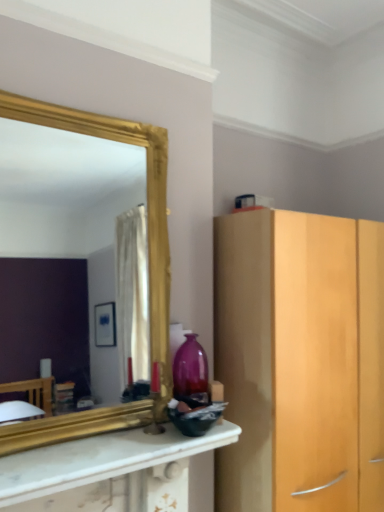
You are a GUI agent. You are given a task and a screenshot of the screen. Output one action in this format:
    pyautogui.click(x=<x>, y=<y>)
    Task: Click on the matte purple glass vase at center
    
    Given the screenshot: What is the action you would take?
    pyautogui.click(x=190, y=369)

Where is `white marble countertop at center`? This screenshot has width=384, height=512. white marble countertop at center is located at coordinates coord(108,472).

The width and height of the screenshot is (384, 512). What do you see at coordinates (69, 210) in the screenshot? I see `gold-framed mirror at upper left` at bounding box center [69, 210].

This screenshot has height=512, width=384. I want to click on matte purple glass vase at center, so click(x=190, y=369).

Does point (82, 158) appear closer or farther from the camera than point (21, 501)?

Point (82, 158) appears to be farther away from the viewer than point (21, 501).

Is gold-framed mirror at upper left spatially inside white marble countertop at center, or outside of it?

gold-framed mirror at upper left is not inside white marble countertop at center, it's outside.

You are a GUI agent. You are given a task and a screenshot of the screen. Output one action in this format:
    pyautogui.click(x=<x>, y=<y>)
    Task: Click on the mirror on the left of white marble countertop at center
    The height and width of the screenshot is (512, 384).
    Given the screenshot: What is the action you would take?
    pyautogui.click(x=69, y=210)

Between gold-framed mirror at upper left and white marble countertop at center, which one has larger width?

Wider between the two is white marble countertop at center.

From a real-world perspective, which object stands above the other?

In real-world perspective, gold-framed mirror at upper left is above.

Considering the positions of objects matte purple glass vase at center and gold-framed mirror at upper left in the image provided, who is more to the right, matte purple glass vase at center or gold-framed mirror at upper left?

From the viewer's perspective, matte purple glass vase at center appears more on the right side.

Considering the sizes of objects matte purple glass vase at center and gold-framed mirror at upper left in the image provided, who is shorter, matte purple glass vase at center or gold-framed mirror at upper left?

matte purple glass vase at center is shorter.

Is matte purple glass vase at center not close to gold-framed mirror at upper left?

Yes, matte purple glass vase at center is far from gold-framed mirror at upper left.

Could you tell me if white marble countertop at center is facing matte purple glass vase at center?

No, white marble countertop at center is not oriented towards matte purple glass vase at center.

Which of these two, white marble countertop at center or matte purple glass vase at center, stands taller?

matte purple glass vase at center is taller.

Which object is closer to the camera taking this photo, white marble countertop at center or matte purple glass vase at center?

white marble countertop at center is in front.

Is matte purple glass vase at center facing away from white marble countertop at center?

No.

Are matte purple glass vase at center and white marble countertop at center far apart?

Actually, matte purple glass vase at center and white marble countertop at center are a little close together.

Can you confirm if matte purple glass vase at center is bigger than white marble countertop at center?

No, matte purple glass vase at center is not bigger than white marble countertop at center.

How different are the orientations of gold-framed mirror at upper left and matte purple glass vase at center in degrees?

7.44 degrees.

Considering the points (101, 232) and (186, 362), which point is in front, point (101, 232) or point (186, 362)?

The point (186, 362) is in front.

Is gold-framed mirror at upper left located outside matte purple glass vase at center?

Yes.

Between gold-framed mirror at upper left and matte purple glass vase at center, which one has more height?

gold-framed mirror at upper left is taller.

You are a GUI agent. You are given a task and a screenshot of the screen. Output one action in this format:
    pyautogui.click(x=<x>, y=<y>)
    Task: Click on the countertop that is on the right side of gold-framed mirror at upper left
    
    Given the screenshot: What is the action you would take?
    pyautogui.click(x=108, y=472)

Is white marble countertop at center situated inside gold-framed mirror at upper left or outside?

white marble countertop at center is spatially situated outside gold-framed mirror at upper left.

Which object is wider, white marble countertop at center or gold-framed mirror at upper left?

white marble countertop at center is wider.

The width and height of the screenshot is (384, 512). Find the location of `countertop below the gold-framed mirror at upper left (from the image's perspective)`. countertop below the gold-framed mirror at upper left (from the image's perspective) is located at coordinates (108, 472).

Locate an element on the screen. mirror in front of the matte purple glass vase at center is located at coordinates click(69, 210).

Estimate the real-world distances between objects in this image. Which object is further from white marble countertop at center, gold-framed mirror at upper left or matte purple glass vase at center?

gold-framed mirror at upper left.

When comparing their distances from matte purple glass vase at center, does white marble countertop at center or gold-framed mirror at upper left seem further?

gold-framed mirror at upper left is positioned further to the anchor matte purple glass vase at center.

Consider the image. Estimate the real-world distances between objects in this image. Which object is closer to gold-framed mirror at upper left, white marble countertop at center or matte purple glass vase at center?

white marble countertop at center is closer to gold-framed mirror at upper left.

Looking at the image, which one is located further to gold-framed mirror at upper left, matte purple glass vase at center or white marble countertop at center?

Among the two, matte purple glass vase at center is located further to gold-framed mirror at upper left.

Estimate the real-world distances between objects in this image. Which object is closer to white marble countertop at center, matte purple glass vase at center or gold-framed mirror at upper left?

matte purple glass vase at center.

Looking at the image, which one is located further to matte purple glass vase at center, gold-framed mirror at upper left or white marble countertop at center?

Among the two, gold-framed mirror at upper left is located further to matte purple glass vase at center.

This screenshot has height=512, width=384. What are the coordinates of `vase between gold-framed mirror at upper left and white marble countertop at center vertically` in the screenshot? It's located at (190, 369).